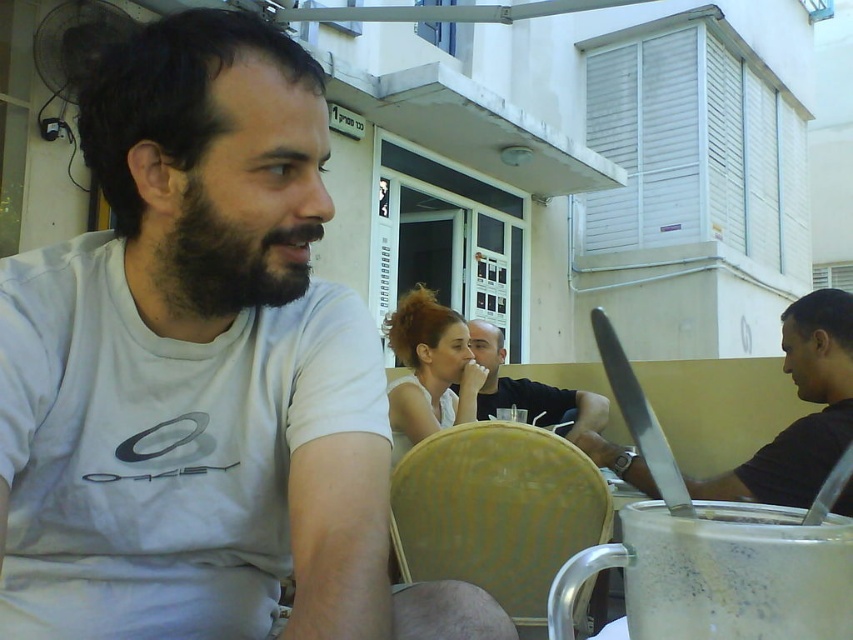
Question: Can you confirm if silver metallic laptop at right is wider than matte white blouse at center?

Choices:
 (A) no
 (B) yes

Answer: (B)

Question: Can you confirm if matte white blouse at center is smaller than matte black shirt at center?

Choices:
 (A) no
 (B) yes

Answer: (B)

Question: Estimate the real-world distances between objects in this image. Which object is farther from the silver metallic laptop at right?

Choices:
 (A) matte black shirt at center
 (B) white matte t-shirt at center
 (C) white frothy beverage at lower right
 (D) matte white blouse at center

Answer: (C)

Question: Which of the following is the closest to the observer?

Choices:
 (A) (737, 465)
 (B) (415, 400)

Answer: (A)

Question: Among these points, which one is farthest from the camera?

Choices:
 (A) (289, 499)
 (B) (399, 356)

Answer: (B)

Question: Is white matte t-shirt at center thinner than silver metallic laptop at right?

Choices:
 (A) yes
 (B) no

Answer: (A)